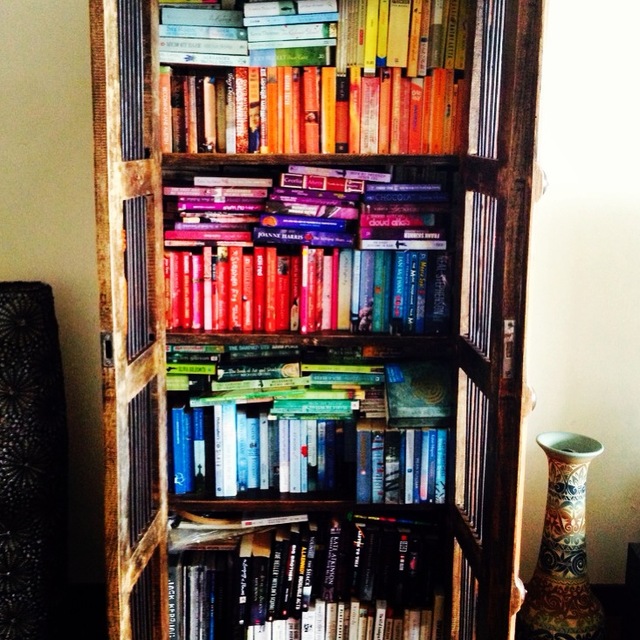
Find the location of a particular element. storage is located at coordinates (285, 290).